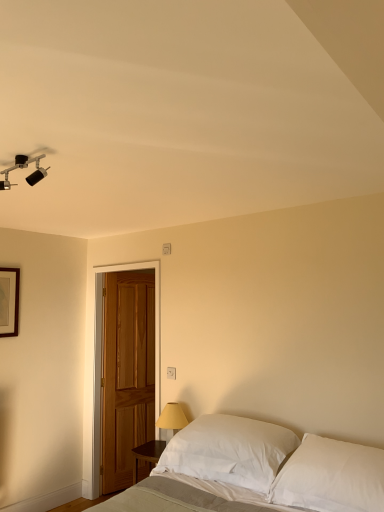
How much space does white soft pillow at lower right, which ranks as the 2th pillow in right-to-left order, occupy horizontally?

17.07 inches.

Where is `yellow fabric lampshade at lower center`? The height and width of the screenshot is (512, 384). yellow fabric lampshade at lower center is located at coordinates (172, 417).

This screenshot has height=512, width=384. What do you see at coordinates (9, 301) in the screenshot?
I see `wooden picture frame at upper left` at bounding box center [9, 301].

The width and height of the screenshot is (384, 512). Find the location of `matte black track light at upper left`. matte black track light at upper left is located at coordinates (23, 168).

Is white plastic electric outlet at center bigger than matte black track light at upper left?

Actually, white plastic electric outlet at center might be smaller than matte black track light at upper left.

Considering the relative positions of white plastic electric outlet at center and matte black track light at upper left in the image provided, is white plastic electric outlet at center to the left of matte black track light at upper left from the viewer's perspective?

Incorrect, white plastic electric outlet at center is not on the left side of matte black track light at upper left.

From a real-world perspective, is white plastic electric outlet at center positioned under matte black track light at upper left based on gravity?

Yes, from a real-world perspective, white plastic electric outlet at center is below matte black track light at upper left.

Which is nearer, (173, 368) or (15, 163)?

Point (173, 368) appears to be farther away from the viewer than point (15, 163).

Which is more to the right, white soft pillow at lower right, which ranks as the 2th pillow in right-to-left order, or matte black track light at upper left?

white soft pillow at lower right, which ranks as the 2th pillow in right-to-left order, is more to the right.

Image resolution: width=384 pixels, height=512 pixels. In order to click on lamp located above the white soft pillow at lower right, which is the first pillow from left to right (from the image's perspective) in this screenshot , I will do `click(23, 168)`.

From the image's perspective, is white soft pillow at lower right, which ranks as the 2th pillow in right-to-left order, located beneath white cotton pillow at lower right, which ranks as the first pillow in right-to-left order?

Yes.

Is white soft pillow at lower right, which ranks as the 2th pillow in right-to-left order, next to white cotton pillow at lower right, which ranks as the first pillow in right-to-left order, and touching it?

No, white soft pillow at lower right, which ranks as the 2th pillow in right-to-left order, is not in contact with white cotton pillow at lower right, which ranks as the first pillow in right-to-left order.

Where is `pillow below the white cotton pillow at lower right, which ranks as the first pillow in right-to-left order (from the image's perspective)`? The width and height of the screenshot is (384, 512). pillow below the white cotton pillow at lower right, which ranks as the first pillow in right-to-left order (from the image's perspective) is located at coordinates (229, 451).

Considering the relative sizes of white soft pillow at lower right, which ranks as the 2th pillow in right-to-left order, and white cotton pillow at lower right, placed as the 2th pillow when sorted from left to right, in the image provided, is white soft pillow at lower right, which ranks as the 2th pillow in right-to-left order, wider than white cotton pillow at lower right, placed as the 2th pillow when sorted from left to right,?

Incorrect, the width of white soft pillow at lower right, which ranks as the 2th pillow in right-to-left order, does not surpass that of white cotton pillow at lower right, placed as the 2th pillow when sorted from left to right.

Locate an element on the screen. Image resolution: width=384 pixels, height=512 pixels. door to the left of white plastic electric outlet at center is located at coordinates (101, 352).

Which of these two, white plastic electric outlet at center or wooden door at left, is wider?

wooden door at left.

Is wooden door at left at the back of white plastic electric outlet at center?

No, wooden door at left is not at the back of white plastic electric outlet at center.

Which is more distant, (285, 437) or (265, 426)?

Point (265, 426)

Locate an element on the screen. The image size is (384, 512). bed that appears below the white soft pillow at lower right, which is the first pillow from left to right (from the image's perspective) is located at coordinates (275, 464).

Between white soft bed at lower center and white soft pillow at lower right, which is the first pillow from left to right, which one appears on the right side from the viewer's perspective?

white soft pillow at lower right, which is the first pillow from left to right, is more to the right.

Does white plastic electric outlet at center have a lesser width compared to white soft pillow at lower right, which is the first pillow from left to right?

Yes, white plastic electric outlet at center is thinner than white soft pillow at lower right, which is the first pillow from left to right.

Is white plastic electric outlet at center next to white soft pillow at lower right, which ranks as the 2th pillow in right-to-left order, and touching it?

white plastic electric outlet at center is not next to white soft pillow at lower right, which ranks as the 2th pillow in right-to-left order, and they're not touching.

Is white plastic electric outlet at center oriented towards white soft pillow at lower right, which is the first pillow from left to right?

No, white plastic electric outlet at center is not oriented towards white soft pillow at lower right, which is the first pillow from left to right.

From the image's perspective, relative to white soft pillow at lower right, which ranks as the 2th pillow in right-to-left order, is white plastic electric outlet at center above or below?

Clearly, from the image's perspective, white plastic electric outlet at center is above white soft pillow at lower right, which ranks as the 2th pillow in right-to-left order.

At what (x,y) coordinates should I click in order to perform the action: click on electric outlet to the right of wooden picture frame at upper left. Please return your answer as a coordinate pair (x, y). The image size is (384, 512). Looking at the image, I should click on (171, 373).

From the image's perspective, would you say wooden picture frame at upper left is positioned over white plastic electric outlet at center?

Indeed, from the image's perspective, wooden picture frame at upper left is shown above white plastic electric outlet at center.

From a real-world perspective, is wooden picture frame at upper left positioned above or below white plastic electric outlet at center?

wooden picture frame at upper left is situated higher than white plastic electric outlet at center in the real world.

Which of these two, wooden picture frame at upper left or white plastic electric outlet at center, stands shorter?

white plastic electric outlet at center is shorter.

Locate an element on the screen. lamp in front of the white plastic electric outlet at center is located at coordinates (23, 168).

Where is `lamp located above the white soft pillow at lower right, which is the first pillow from left to right (from a real-world perspective)`? lamp located above the white soft pillow at lower right, which is the first pillow from left to right (from a real-world perspective) is located at coordinates (23, 168).

Based on the photo, considering their positions, is white plastic electric outlet at center positioned further to white soft bed at lower center than yellow fabric lampshade at lower center?

Among the two, white plastic electric outlet at center is located further to white soft bed at lower center.

Considering their positions, is white cotton pillow at lower right, which ranks as the first pillow in right-to-left order, positioned closer to white plastic electric outlet at center than yellow fabric lampshade at lower center?

Among the two, yellow fabric lampshade at lower center is located nearer to white plastic electric outlet at center.

Based on their spatial positions, is matte black track light at upper left or white soft bed at lower center closer to white cotton pillow at lower right, placed as the 2th pillow when sorted from left to right?

The object closer to white cotton pillow at lower right, placed as the 2th pillow when sorted from left to right, is white soft bed at lower center.

When comparing their distances from white soft bed at lower center, does matte black track light at upper left or wooden picture frame at upper left seem closer?

The object closer to white soft bed at lower center is matte black track light at upper left.

Based on their spatial positions, is wooden picture frame at upper left or white soft pillow at lower right, which is the first pillow from left to right, closer to white soft bed at lower center?

white soft pillow at lower right, which is the first pillow from left to right, is positioned closer to the anchor white soft bed at lower center.

From the picture: Estimate the real-world distances between objects in this image. Which object is further from white plastic electric outlet at center, matte black track light at upper left or wooden picture frame at upper left?

matte black track light at upper left is positioned further to the anchor white plastic electric outlet at center.

Consider the image. Considering their positions, is wooden picture frame at upper left positioned closer to matte black track light at upper left than yellow fabric lampshade at lower center?

wooden picture frame at upper left is closer to matte black track light at upper left.

From the image, which object appears to be farther from yellow fabric lampshade at lower center, white cotton pillow at lower right, which ranks as the first pillow in right-to-left order, or wooden picture frame at upper left?

Among the two, wooden picture frame at upper left is located further to yellow fabric lampshade at lower center.

At what (x,y) coordinates should I click in order to perform the action: click on table lamp between wooden picture frame at upper left and white soft pillow at lower right, which is the first pillow from left to right, in the horizontal direction. Please return your answer as a coordinate pair (x, y). Looking at the image, I should click on (172, 417).

Locate an element on the screen. The image size is (384, 512). electric outlet positioned between matte black track light at upper left and wooden picture frame at upper left from near to far is located at coordinates (171, 373).

Where is `lamp located between white soft bed at lower center and wooden picture frame at upper left in the depth direction`? The height and width of the screenshot is (512, 384). lamp located between white soft bed at lower center and wooden picture frame at upper left in the depth direction is located at coordinates (23, 168).

I want to click on door between matte black track light at upper left and white soft pillow at lower right, which ranks as the 2th pillow in right-to-left order, vertically, so click(101, 352).